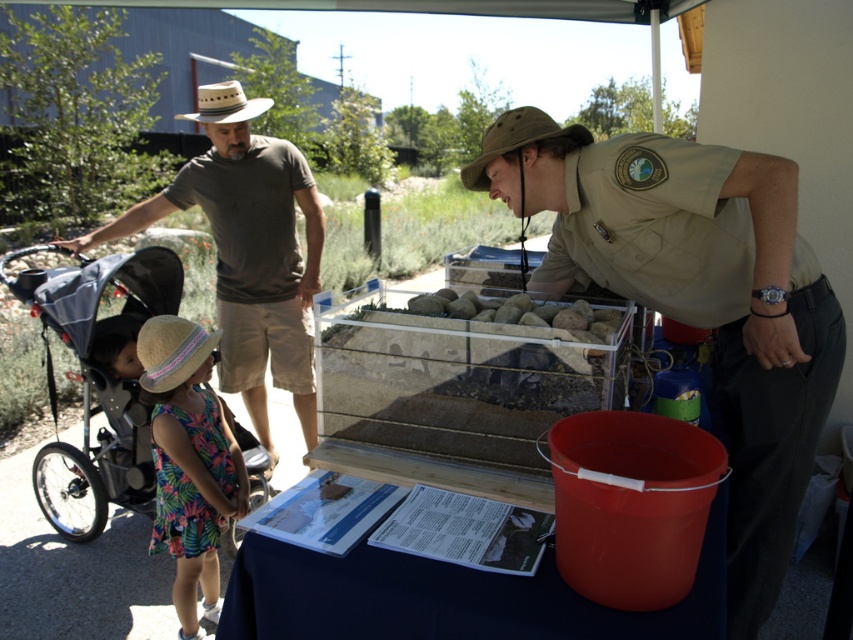
Question: Does khaki uniform at center appear under green canvas hat at upper center?

Choices:
 (A) no
 (B) yes

Answer: (B)

Question: Based on their relative distances, which object is farther from the khaki uniform at center?

Choices:
 (A) floral dress at lower left
 (B) brown woven cowboy hat at upper left
 (C) black fabric stroller at left

Answer: (B)

Question: Which point is closer to the camera taking this photo?

Choices:
 (A) (289, 300)
 (B) (192, 349)

Answer: (B)

Question: Among these objects, which one is nearest to the camera?

Choices:
 (A) brown cotton shirt at left
 (B) black fabric stroller at left
 (C) khaki uniform at center

Answer: (C)

Question: Does black fabric stroller at left appear over brown woven cowboy hat at upper left?

Choices:
 (A) no
 (B) yes

Answer: (A)

Question: Does brown cotton shirt at left appear over floral dress at lower left?

Choices:
 (A) no
 (B) yes

Answer: (B)